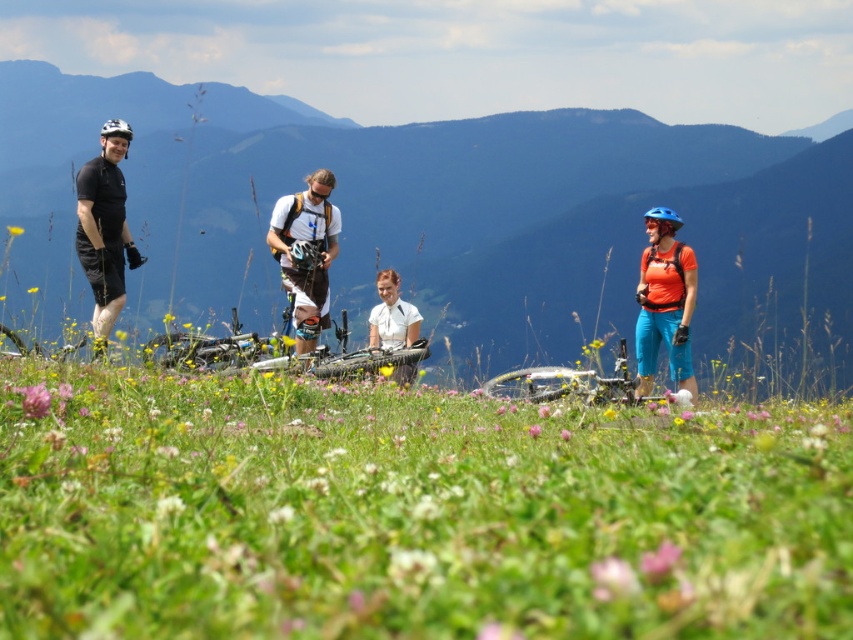
You are a photographer trying to capture a group photo of the matte orange shirt at right and the white matte shirt at center. If you want to ensure both subjects are in focus, which one should you focus on first considering their positions?

Since the matte orange shirt at right might be wider than the white matte shirt at center, you should focus on the matte orange shirt at right first to ensure both are in focus.